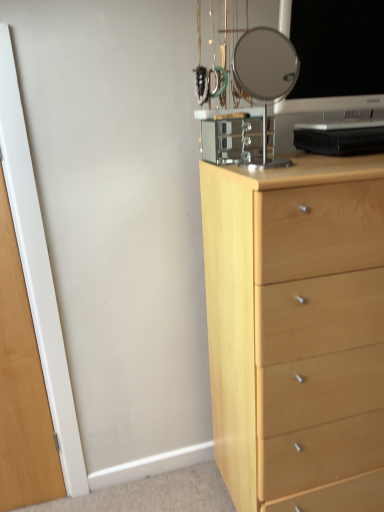
Question: From the image's perspective, is light wood chest of drawers at right above or below clear glass mirror at upper center?

Choices:
 (A) below
 (B) above

Answer: (A)

Question: From a real-world perspective, is light wood chest of drawers at right positioned above or below clear glass mirror at upper center?

Choices:
 (A) above
 (B) below

Answer: (B)

Question: Estimate the real-world distances between objects in this image. Which object is closer to the light wood chest of drawers at right?

Choices:
 (A) clear glass mirror at upper center
 (B) transparent glass door at left
 (C) black glossy computer monitor at upper right

Answer: (C)

Question: Estimate the real-world distances between objects in this image. Which object is farther from the light wood chest of drawers at right?

Choices:
 (A) transparent glass door at left
 (B) clear glass mirror at upper center
 (C) black glossy computer monitor at upper right

Answer: (B)